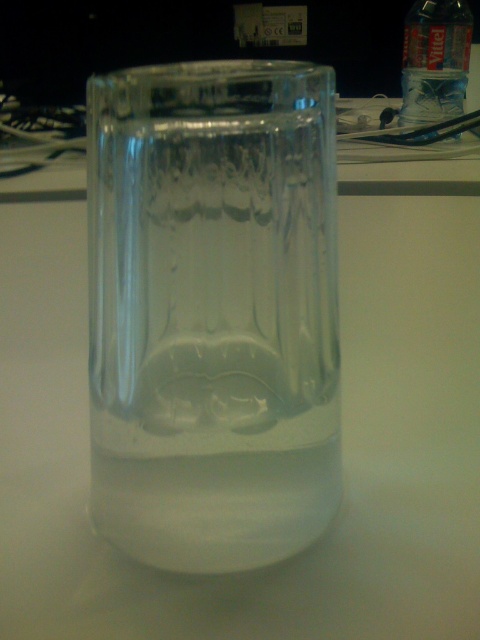
You are a delivery person who needs to place a 6.2 inch long package on the desk. The transparent glass vase at center is in the way. Can you slide the package past the vase without moving it?

The transparent glass vase at center is 5.19 inches from camera. Since the package is 6.2 inches long, it is longer than the distance available, so you cannot slide the package past the vase without moving it.

You are standing in front of a desk with the transparent glass vase at center. There is a point marked at coordinates (213,310). Is this point located on the transparent glass vase at center?

Yes, the transparent glass vase at center is represented by point (213,310), so the point is located on it.

You are organizing items on a desk and see the transparent glass vase at center and the transparent plastic bottle at upper right. Which item is positioned higher up on the desk?

The transparent plastic bottle at upper right is positioned higher up on the desk than the transparent glass vase at center.